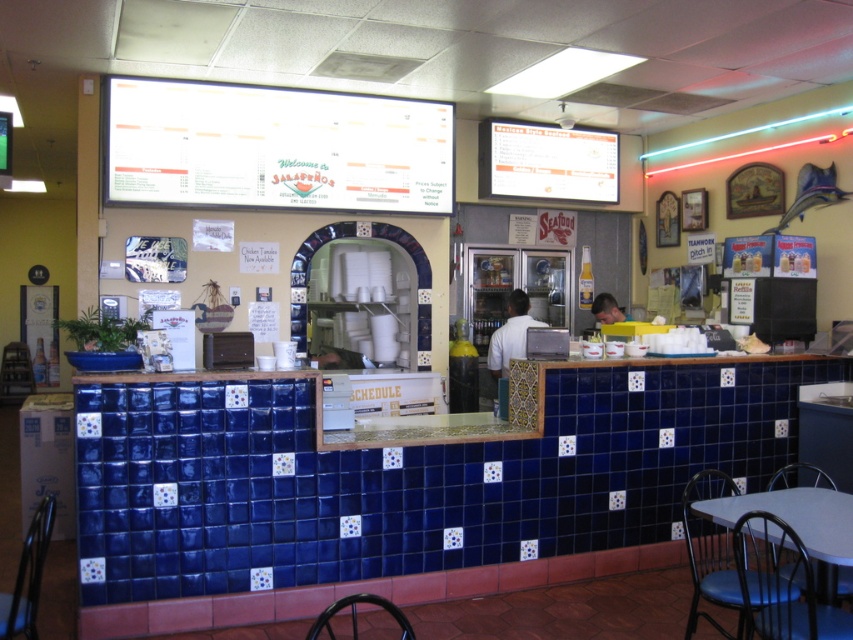
You are a customer standing at the entrance of the restaurant. You see a point marked at coordinates (409, 486). According to the image, where is this point located? Please answer with the exact object label from the scene description.

The point is located on the blue tile counter at center.